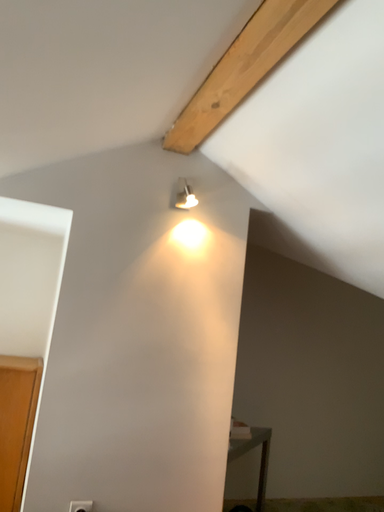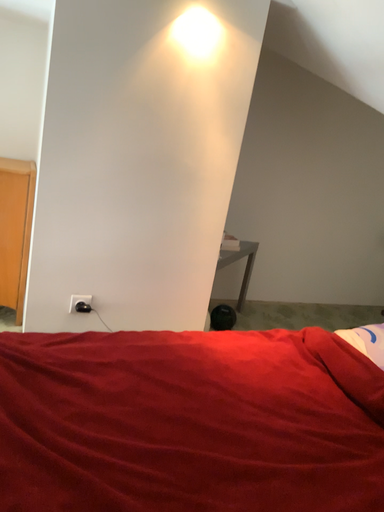
Question: How did the camera likely rotate when shooting the video?

Choices:
 (A) rotated downward
 (B) rotated upward

Answer: (A)